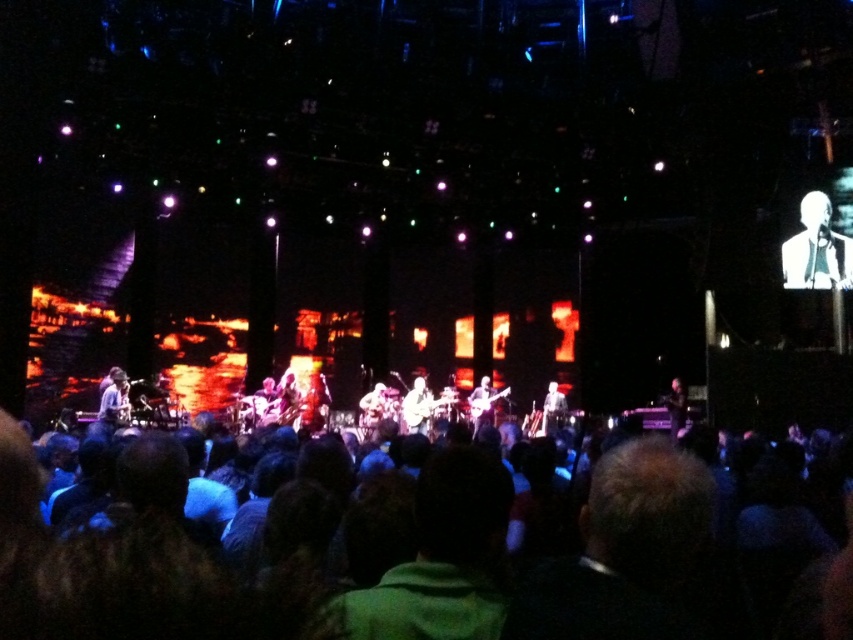
You are a photographer at the concert and want to capture a photo of the dark hair at center and white suit at upper right. Which one is positioned to the left of the other?

The dark hair at center is to the left of white suit at upper right.

You are an audience member at the concert. You notice two performers on stage. One has dark hair at center and another is wearing a white suit at upper right. Which performer is positioned lower on the stage?

The dark hair at center is positioned lower on the stage because it is below the white suit at upper right.